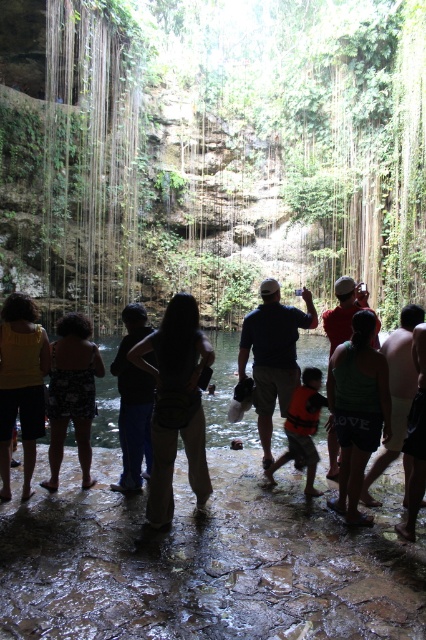
Question: Where is green fabric tank top at center located in relation to dark blue shirt at center in the image?

Choices:
 (A) above
 (B) below

Answer: (B)

Question: Estimate the real-world distances between objects in this image. Which object is closer to the matte khaki pants at center?

Choices:
 (A) matte black shorts at left
 (B) dark blue jeans at center
 (C) floral-patterned shorts at center
 (D) orange life vest at center

Answer: (B)

Question: Is dark blue jeans at center smaller than tan skin person at center?

Choices:
 (A) no
 (B) yes

Answer: (A)

Question: Which of the following is the closest to the observer?

Choices:
 (A) matte khaki pants at center
 (B) dark blue shirt at center
 (C) matte black shorts at left

Answer: (A)

Question: Estimate the real-world distances between objects in this image. Which object is farther from the matte black shorts at left?

Choices:
 (A) orange life vest at center
 (B) matte khaki pants at center
 (C) tan skin person at center
 (D) dark blue jeans at center

Answer: (C)

Question: Does matte khaki pants at center have a larger size compared to dark blue jeans at center?

Choices:
 (A) yes
 (B) no

Answer: (B)